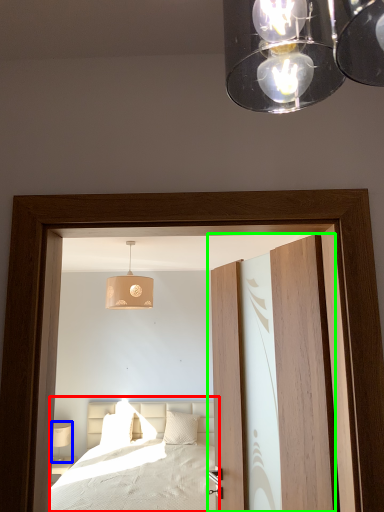
Question: Which object is the closest to the bed (highlighted by a red box)? Choose among these: table lamp (highlighted by a blue box) or door (highlighted by a green box).

Choices:
 (A) table lamp
 (B) door

Answer: (A)